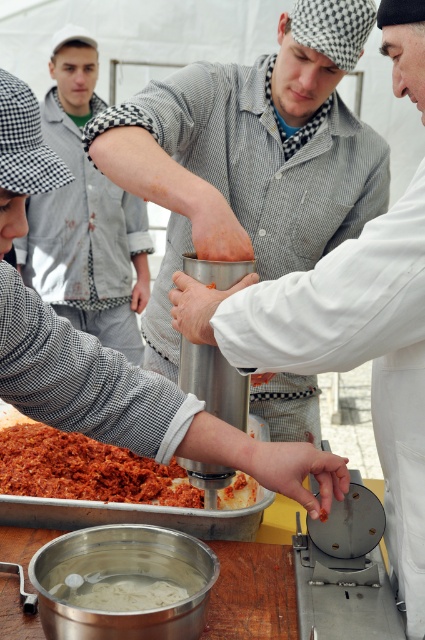
Question: Which object is positioned farthest from the shredded red meat at lower left?

Choices:
 (A) white creamy pasta at lower center
 (B) checkered fabric shirt at upper left
 (C) checkered fabric shirt at center

Answer: (B)

Question: Which point is closer to the camera taking this photo?

Choices:
 (A) (53, 224)
 (B) (53, 468)

Answer: (B)

Question: Which of these objects is positioned closest to the checkered fabric shirt at center?

Choices:
 (A) checkered fabric shirt at upper left
 (B) white creamy pasta at lower center
 (C) shredded red meat at lower left

Answer: (C)

Question: Where is matte gray shirt at center located in relation to checkered fabric shirt at upper left in the image?

Choices:
 (A) above
 (B) below

Answer: (B)

Question: Can you confirm if checkered fabric shirt at center is positioned above checkered fabric shirt at upper left?

Choices:
 (A) yes
 (B) no

Answer: (B)

Question: Is matte gray shirt at center thinner than shredded red meat at lower left?

Choices:
 (A) yes
 (B) no

Answer: (A)